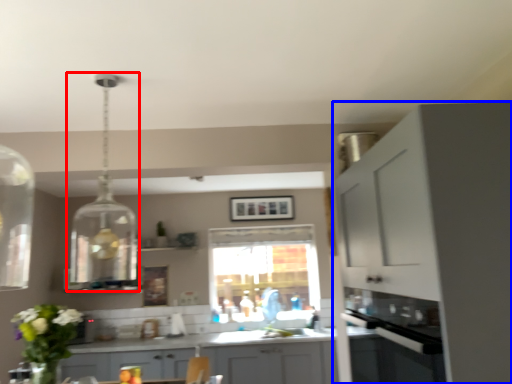
Question: Which point is closer to the camera, light fixture (highlighted by a red box) or cabinetry (highlighted by a blue box)?

Choices:
 (A) light fixture
 (B) cabinetry

Answer: (B)